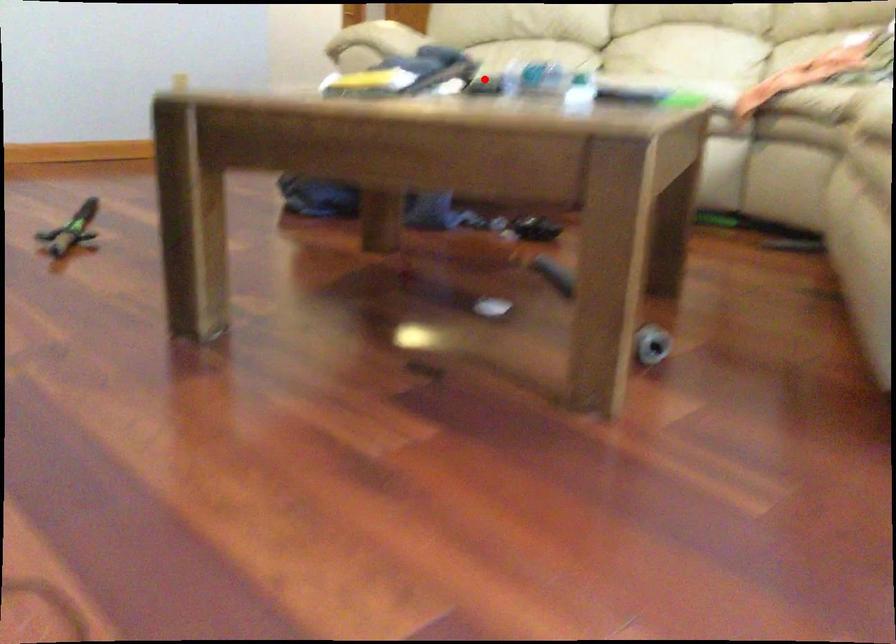
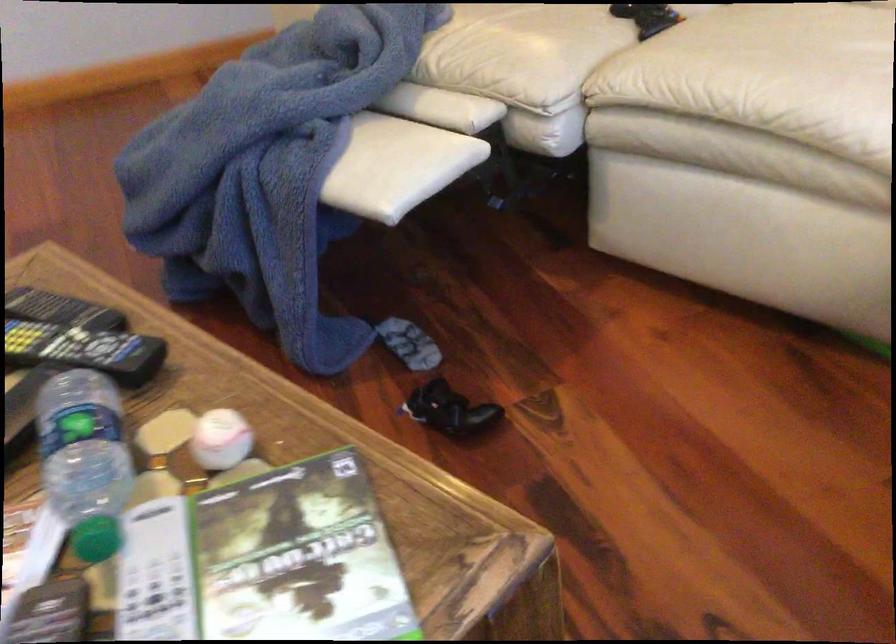
Find the pixel in the second image that matches the highlighted location in the first image.

(84, 350)